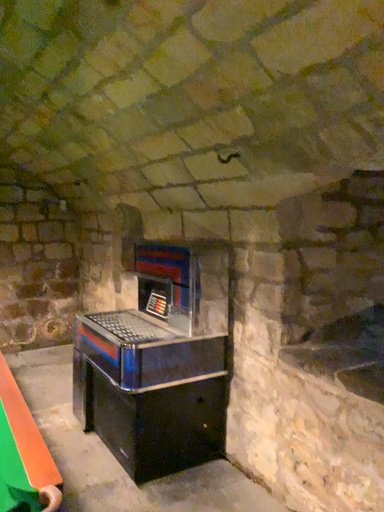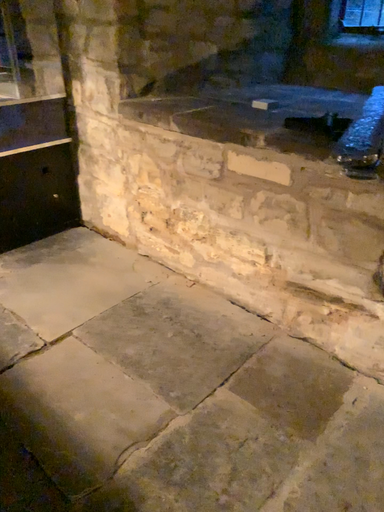
Question: Which way did the camera rotate in the video?

Choices:
 (A) rotated upward
 (B) rotated downward

Answer: (B)